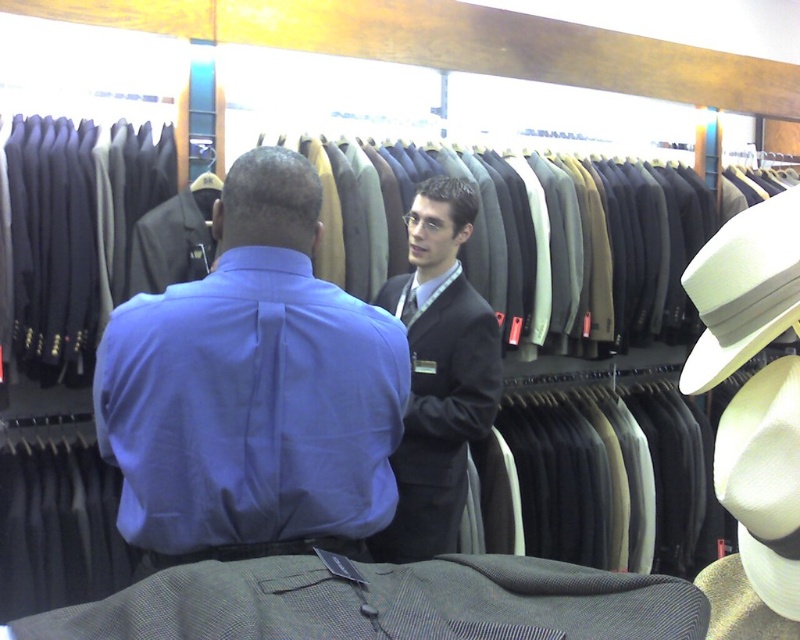
Question: Is blue satin shirt at center above dark gray suit at center?

Choices:
 (A) no
 (B) yes

Answer: (B)

Question: Is blue satin shirt at center wider than dark gray suit at center?

Choices:
 (A) yes
 (B) no

Answer: (A)

Question: Estimate the real-world distances between objects in this image. Which object is farther from the blue satin shirt at center?

Choices:
 (A) dark gray suit at center
 (B) white felt cowboy hat at right

Answer: (A)

Question: Does dark gray suit at center have a greater width compared to white felt cowboy hat at right?

Choices:
 (A) no
 (B) yes

Answer: (B)

Question: Which object is farther from the camera taking this photo?

Choices:
 (A) white felt cowboy hat at right
 (B) blue satin shirt at center

Answer: (B)

Question: Among these objects, which one is nearest to the camera?

Choices:
 (A) white felt cowboy hat at right
 (B) blue satin shirt at center

Answer: (A)